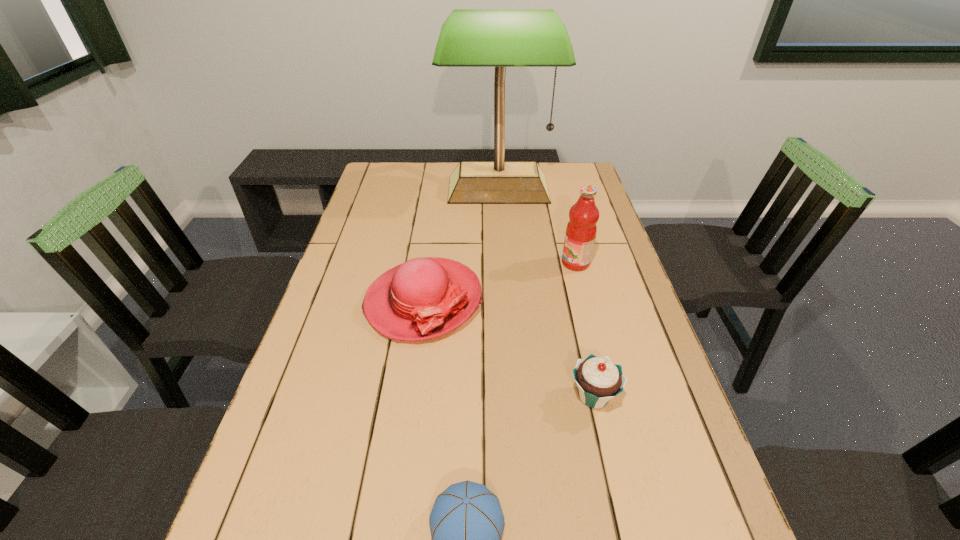
Find the location of `the farthest object`. the farthest object is located at coordinates (500, 38).

The image size is (960, 540). Find the location of `the tallest object`. the tallest object is located at coordinates (500, 38).

Locate an element on the screen. This screenshot has height=540, width=960. the second tallest object is located at coordinates (581, 230).

You are a GUI agent. You are given a task and a screenshot of the screen. Output one action in this format:
    pyautogui.click(x=<x>, y=<y>)
    Task: Click on the hat
    The image size is (960, 540).
    Given the screenshot: What is the action you would take?
    pyautogui.click(x=423, y=298)

At what (x,y) coordinates should I click in order to perform the action: click on the fourth farthest object. Please return your answer as a coordinate pair (x, y). Looking at the image, I should click on (599, 380).

This screenshot has height=540, width=960. I want to click on vacant space located 0.240m on the metallic stand of the table lamp, so click(x=502, y=255).

Identify the location of free spot located 0.260m on the front label of the second tallest object. (475, 263).

At what (x,y) coordinates should I click in order to perform the action: click on vacant region located 0.340m on the front label of the second tallest object. Please return your answer as a coordinate pair (x, y). This screenshot has height=540, width=960. Looking at the image, I should click on (448, 263).

Identify the location of vacant space situated on the front label of the second tallest object. The height and width of the screenshot is (540, 960). (442, 263).

Find the location of a particular element. The width and height of the screenshot is (960, 540). free location located at the front of the hat with a bow is located at coordinates (403, 447).